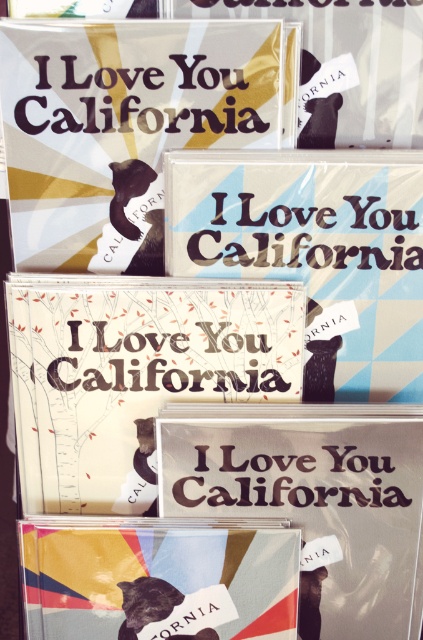
The height and width of the screenshot is (640, 423). What do you see at coordinates (121, 128) in the screenshot?
I see `matte paper poster at upper center` at bounding box center [121, 128].

This screenshot has height=640, width=423. Find the location of `matte paper poster at upper center`. matte paper poster at upper center is located at coordinates (121, 128).

Which is above, blue paper poster at center or matte paper cd at center?

blue paper poster at center

Is point (331, 289) positioned in front of point (208, 612)?

Yes.

I want to click on blue paper poster at center, so click(x=315, y=252).

Is matte paper card at center bigger than matte paper poster at center?

Indeed, matte paper card at center has a larger size compared to matte paper poster at center.

The image size is (423, 640). What are the coordinates of `matte paper card at center` in the screenshot? It's located at click(134, 374).